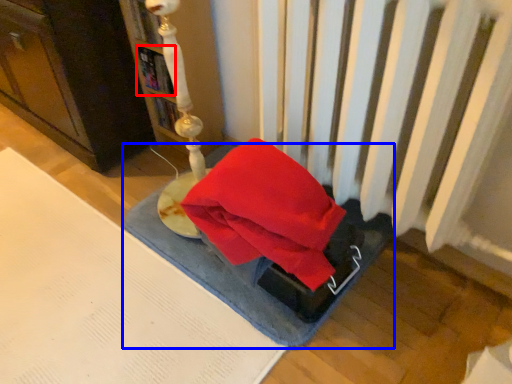
Question: Which object is closer to the camera taking this photo, book (highlighted by a red box) or yoga mat (highlighted by a blue box)?

Choices:
 (A) book
 (B) yoga mat

Answer: (B)